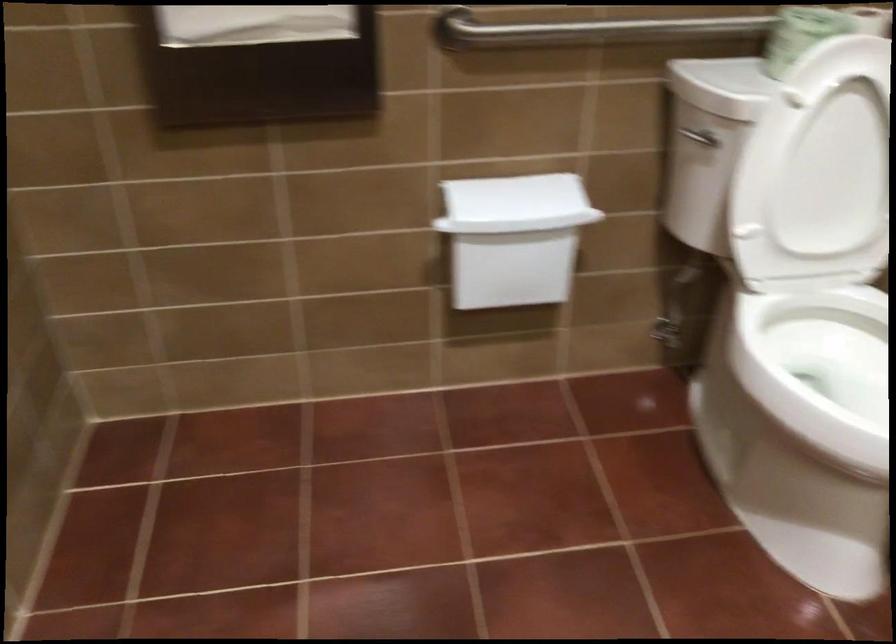
First-person continuous shooting, in which direction is the camera rotating?

The camera's rotation is toward right-down.